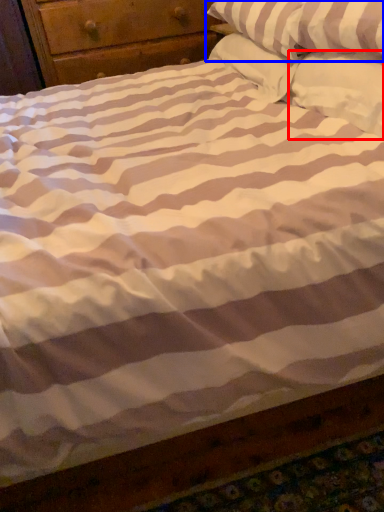
Question: Which point is closer to the camera, pillow (highlighted by a red box) or pillow (highlighted by a blue box)?

Choices:
 (A) pillow
 (B) pillow

Answer: (A)